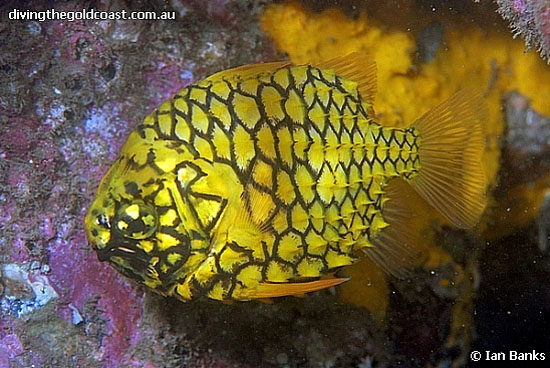
At what (x,y) coordinates should I click in order to perform the action: click on scales. Please return your answer as a coordinate pair (x, y). The width and height of the screenshot is (550, 368). Looking at the image, I should click on (272, 172).